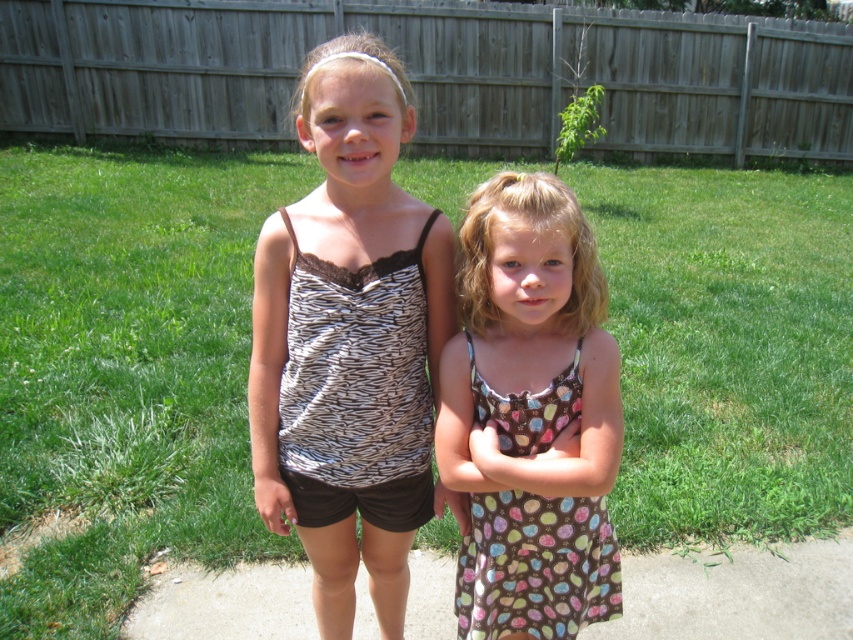
Is zebra-patterned tank top at center bigger than gray concrete pavement at lower center?

Correct, zebra-patterned tank top at center is larger in size than gray concrete pavement at lower center.

Looking at this image, can you confirm if zebra-patterned tank top at center is positioned to the left of gray concrete pavement at lower center?

Correct, you'll find zebra-patterned tank top at center to the left of gray concrete pavement at lower center.

Who is more distant from viewer, (337, 177) or (144, 627)?

The point (144, 627) is more distant.

Identify the location of zebra-patterned tank top at center. (349, 339).

Is point (537, 586) closer to camera compared to point (680, 616)?

Yes.

Is brown dotted dress at center shorter than gray concrete pavement at lower center?

No, brown dotted dress at center is not shorter than gray concrete pavement at lower center.

At what (x,y) coordinates should I click in order to perform the action: click on brown dotted dress at center. Please return your answer as a coordinate pair (x, y). The width and height of the screenshot is (853, 640). Looking at the image, I should click on (531, 416).

Which is in front, point (258, 326) or point (549, 442)?

Positioned in front is point (549, 442).

Can you confirm if zebra-patterned tank top at center is thinner than brown dotted dress at center?

In fact, zebra-patterned tank top at center might be wider than brown dotted dress at center.

I want to click on zebra-patterned tank top at center, so click(x=349, y=339).

You are a GUI agent. You are given a task and a screenshot of the screen. Output one action in this format:
    pyautogui.click(x=<x>, y=<y>)
    Task: Click on the zebra-patterned tank top at center
    This screenshot has height=640, width=853.
    Given the screenshot: What is the action you would take?
    pyautogui.click(x=349, y=339)